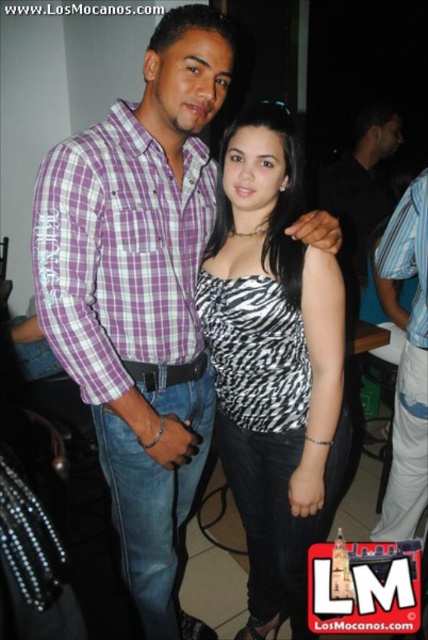
Question: Considering the real-world distances, which object is closest to the striped shirt at right?

Choices:
 (A) zebra print top at center
 (B) purple checkered shirt at center

Answer: (A)

Question: Which point appears closest to the camera in this image?

Choices:
 (A) (326, 317)
 (B) (403, 273)
 (C) (124, 140)

Answer: (C)

Question: Considering the relative positions of purple checkered shirt at center and zebra print top at center in the image provided, where is purple checkered shirt at center located with respect to zebra print top at center?

Choices:
 (A) below
 (B) above

Answer: (B)

Question: Does zebra print top at center have a smaller size compared to striped shirt at right?

Choices:
 (A) yes
 (B) no

Answer: (B)

Question: Considering the relative positions of zebra print top at center and striped shirt at right in the image provided, where is zebra print top at center located with respect to striped shirt at right?

Choices:
 (A) right
 (B) left

Answer: (B)

Question: Which of the following is the farthest from the observer?

Choices:
 (A) (299, 360)
 (B) (422, 467)

Answer: (B)